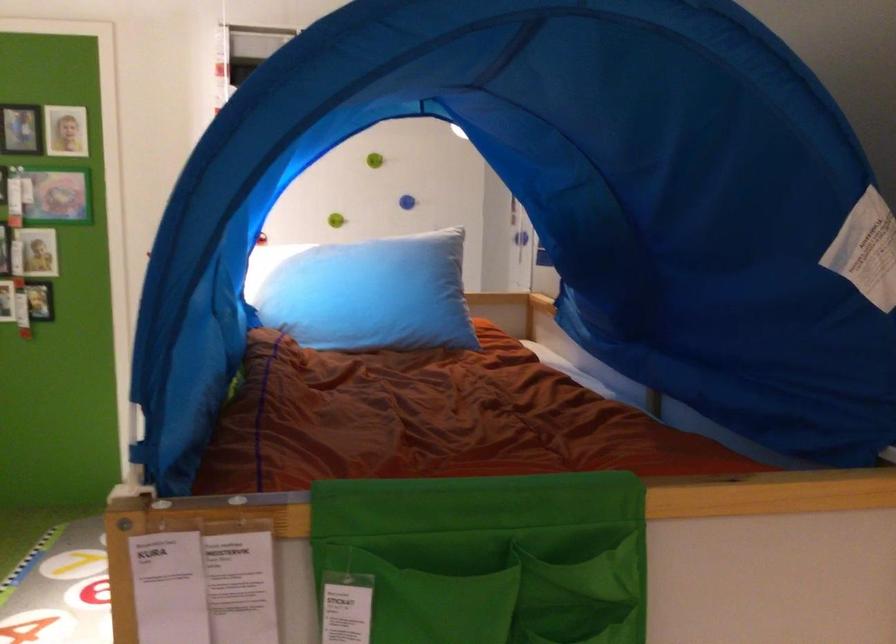
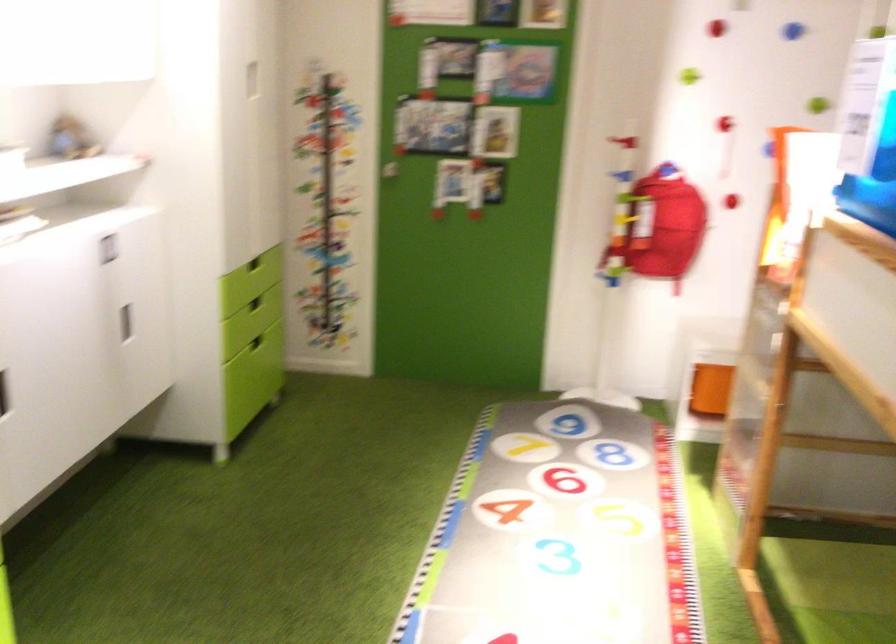
In the second image, find the point that corresponds to the point at 307,180 in the first image.

(793, 31)